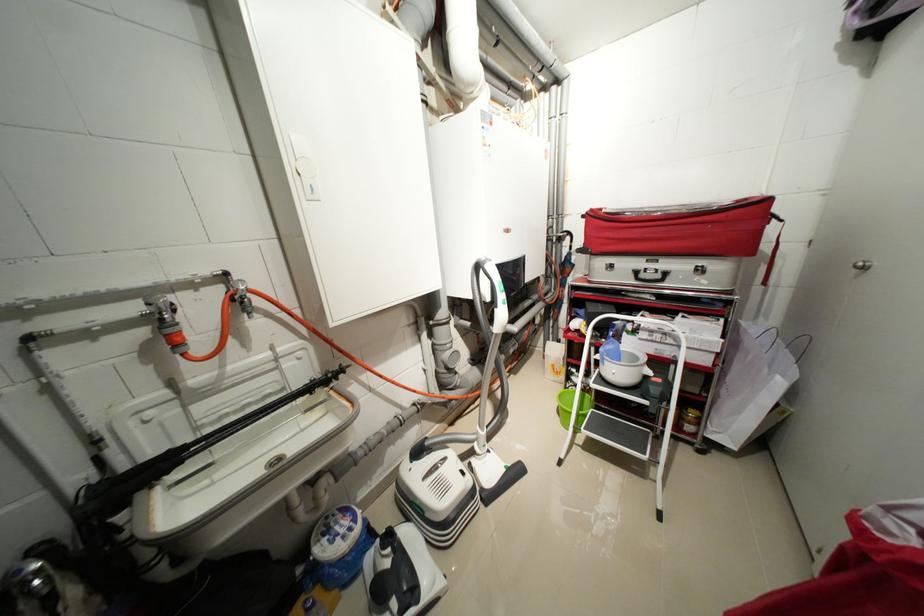
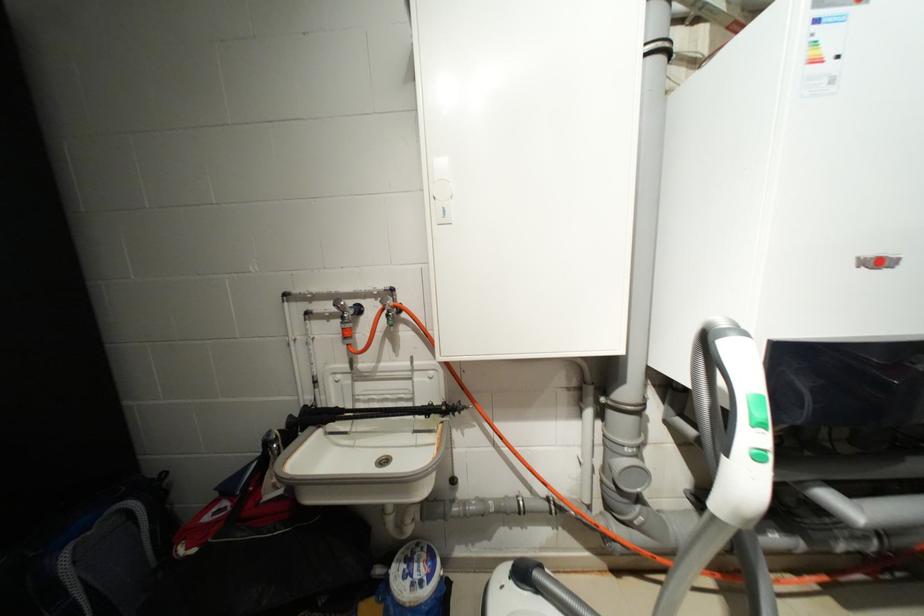
Question: The camera is either moving clockwise (left) or counter-clockwise (right) around the object. The first image is from the beginning of the video and the second image is from the end. Is the camera moving left or right when shooting the video?

Choices:
 (A) Left
 (B) Right

Answer: (B)